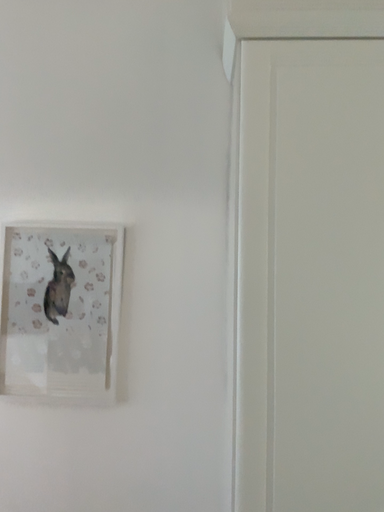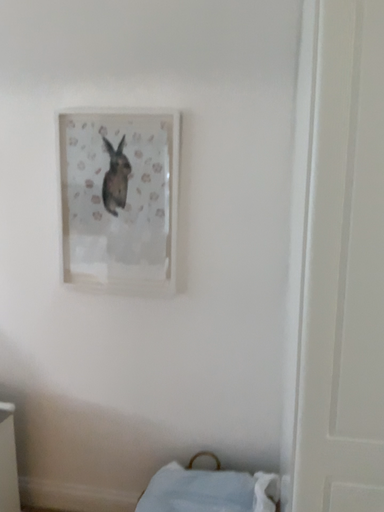
Question: How did the camera likely rotate when shooting the video?

Choices:
 (A) rotated downward
 (B) rotated upward

Answer: (A)